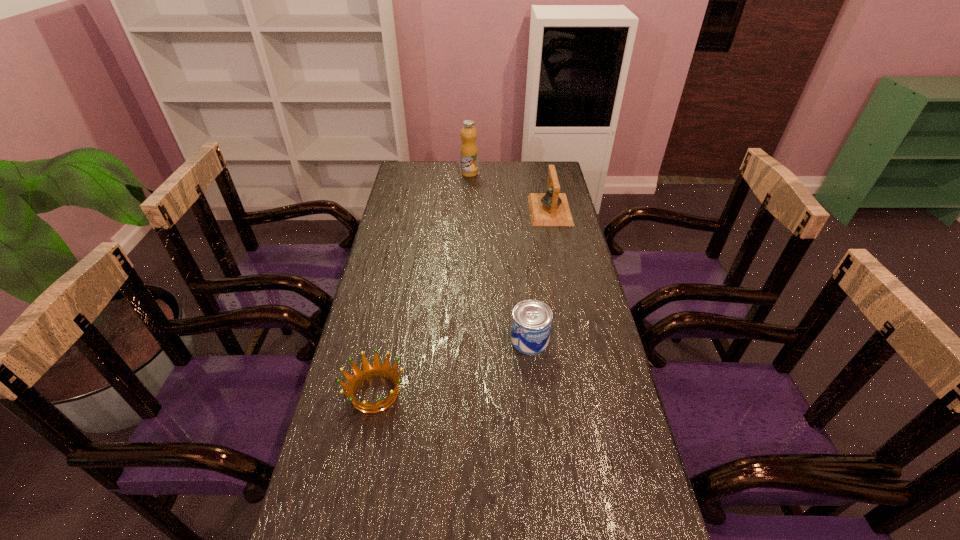
This screenshot has width=960, height=540. I want to click on empty space that is in between the crown and the rightmost object, so click(463, 301).

Find the location of `free space between the bell and the nearest object`. free space between the bell and the nearest object is located at coordinates (463, 301).

This screenshot has width=960, height=540. What are the coordinates of `vacant area between the third object from left to right and the leftmost object` in the screenshot? It's located at (452, 366).

The height and width of the screenshot is (540, 960). Identify the location of empty space between the crown and the second tallest object. coord(463,301).

This screenshot has width=960, height=540. In order to click on free space between the shortest object and the tallest object in this screenshot , I will do `click(422, 283)`.

Image resolution: width=960 pixels, height=540 pixels. Find the location of `free area in between the can and the second farthest object`. free area in between the can and the second farthest object is located at coordinates (540, 275).

The image size is (960, 540). Find the location of `the second closest object relative to the second nearest object`. the second closest object relative to the second nearest object is located at coordinates click(x=551, y=208).

What are the coordinates of `the third closest object to the bell` in the screenshot? It's located at (368, 371).

The image size is (960, 540). In order to click on blank area in the image that satisfies the following two spatial constraints: 1. on the back side of the rightmost object; 2. on the front label of the fruit juice in this screenshot , I will do (x=542, y=173).

The image size is (960, 540). I want to click on vacant region that satisfies the following two spatial constraints: 1. on the front label of the tallest object; 2. on the left side of the rightmost object, so click(x=468, y=210).